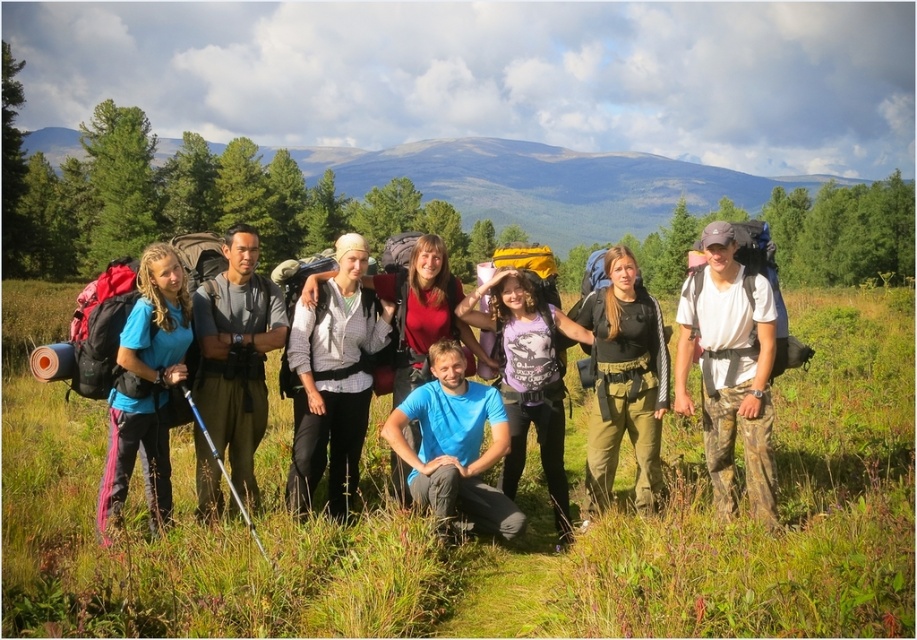
Can you confirm if black matte shirt at center is positioned to the left of teal matte shirt at left?

No, black matte shirt at center is not to the left of teal matte shirt at left.

Measure the distance between black matte shirt at center and camera.

black matte shirt at center and camera are 5.83 meters apart from each other.

Where is `black matte shirt at center`? black matte shirt at center is located at coordinates coord(624,384).

Can you confirm if matte black backpacks at center is thinner than blue matte shirt at center?

No.

Which is in front, point (311, 381) or point (473, 509)?

Point (473, 509) is in front.

Is point (164, 372) closer to camera compared to point (437, 454)?

Yes, point (164, 372) is in front of point (437, 454).

In order to click on matte black backpacks at center in this screenshot , I will do `click(477, 292)`.

Locate an element on the screen. This screenshot has height=640, width=917. teal matte shirt at left is located at coordinates (145, 387).

Is point (98, 525) positioned in front of point (466, 417)?

That is True.

Locate an element on the screen. The image size is (917, 640). teal matte shirt at left is located at coordinates (145, 387).